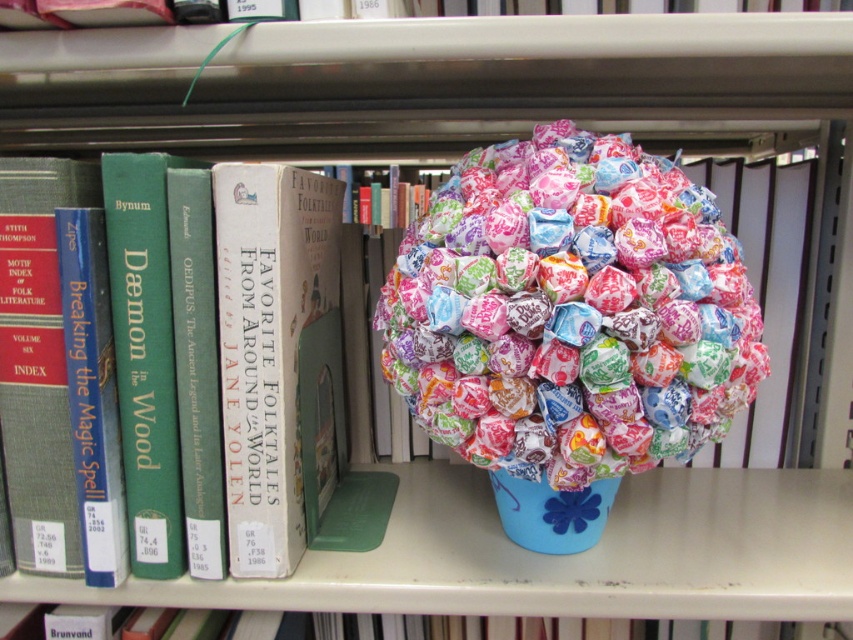
You are organizing a library shelf and notice the colorful paper wrapped at center and the hardcover book at left. Which item is positioned higher on the shelf?

The colorful paper wrapped at center is located above the hardcover book at left, so it is positioned higher on the shelf.

You are a librarian who wants to place a new book on the shelf. The new book has a spine width of 3.5 inches. The shelf has a total width of 12 inches. The existing books on the left occupy 8 inches of space, and the colorful paper wrapped at center takes up 1 inch. Is there enough space left on the shelf to place the new book?

The existing books on the left occupy 8 inches, and the colorful paper wrapped at center takes up 1 inch, totaling 9 inches. The shelf has a total width of 12 inches, so there are 3 inches remaining. Since the new book requires 3.5 inches, there is not enough space left to place it.

You are a librarian organizing items on a shelf. You have a candy arrangement and books. The candy arrangement is at point [572,310]. Where should you place a new book so it aligns with the existing books on the left side of the shelf?

Place the new book on the left side of the shelf where the existing books are neatly aligned, away from the candy arrangement at point [572,310].